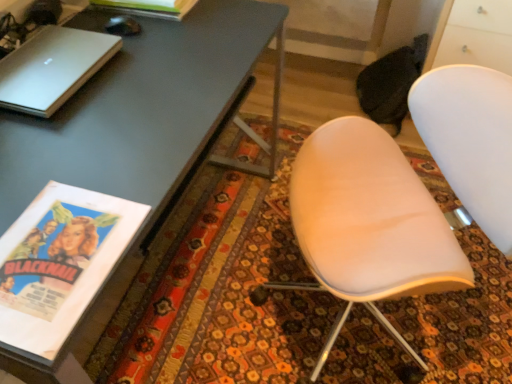
You are a GUI agent. You are given a task and a screenshot of the screen. Output one action in this format:
    pyautogui.click(x=<x>, y=<y>)
    Task: Click on the empty space that is ontop of silver metallic laptop at upper left (from a real-world perspective)
    This screenshot has width=512, height=384.
    Given the screenshot: What is the action you would take?
    pyautogui.click(x=48, y=62)